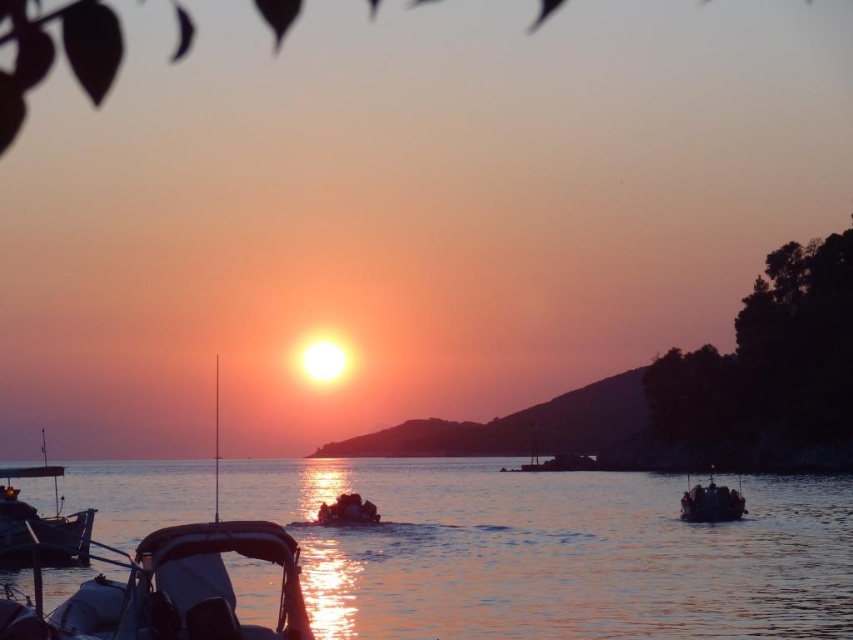
You are standing on the shore and want to board the white matte boat at center and the wooden boat at lower left. Which boat will you reach first if you walk straight towards them?

You will reach the white matte boat at center first because it is closer to the viewer than the wooden boat at lower left.

You are a photographer trying to capture the sunset. You have two boats in your viewfinder, the white matte boat at center and the wooden boat at lower left. Which boat should you focus on to ensure it appears higher in your photo?

The white matte boat at center appears higher than the wooden boat at lower left in the image, so focusing on the white matte boat at center will ensure it is positioned higher in the photo.

You are a photographer trying to capture the sunset. You have a camera with a 24mm lens that can capture a wide angle of 80 degrees. You want to include both the glistening water at center and the metallic blue boat at center in your shot. Can you fit both objects into the frame without moving your position?

The glistening water at center is larger in size than the metallic blue boat at center. Since the water is larger, it will occupy more of the frame, but the 24mm lens with an 80 degree angle should be able to capture both objects as they are both centered in the scene.